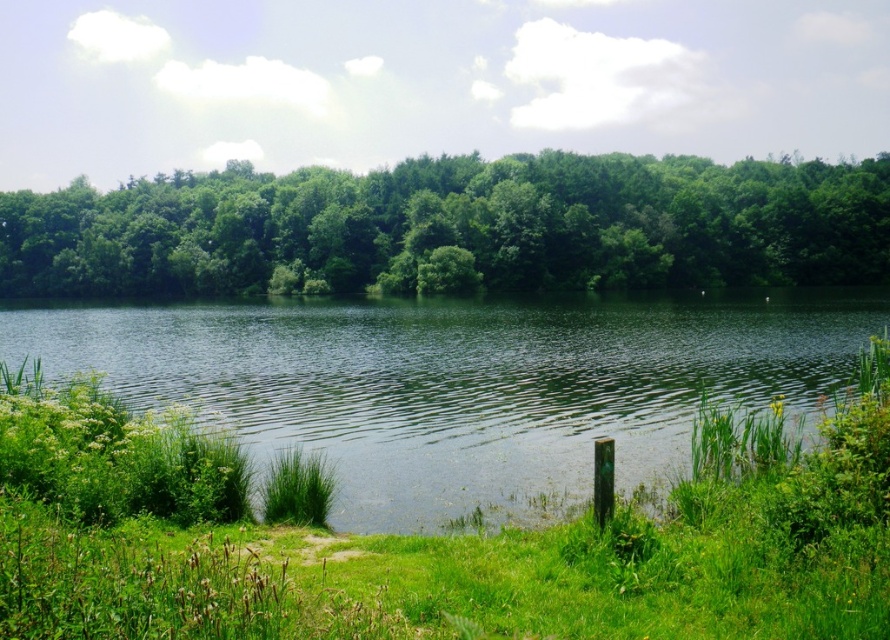
Can you confirm if green liquid water at center is positioned below green leafy trees at upper center?

Correct, green liquid water at center is located below green leafy trees at upper center.

Between point (152, 310) and point (371, 230), which one is positioned in front?

Point (152, 310) is more forward.

Between point (808, 426) and point (344, 230), which one is positioned in front?

Point (808, 426)

Locate an element on the screen. The image size is (890, 640). green liquid water at center is located at coordinates (462, 385).